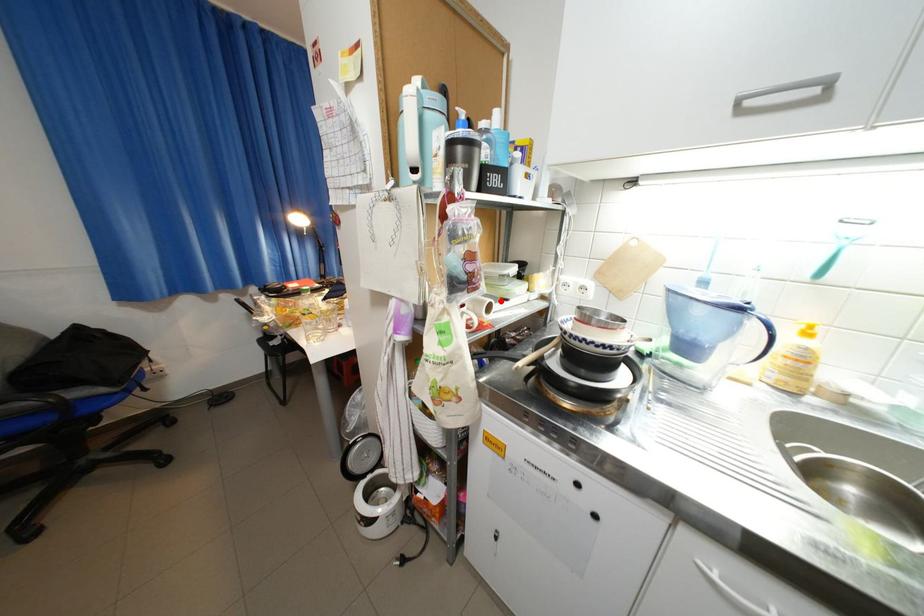
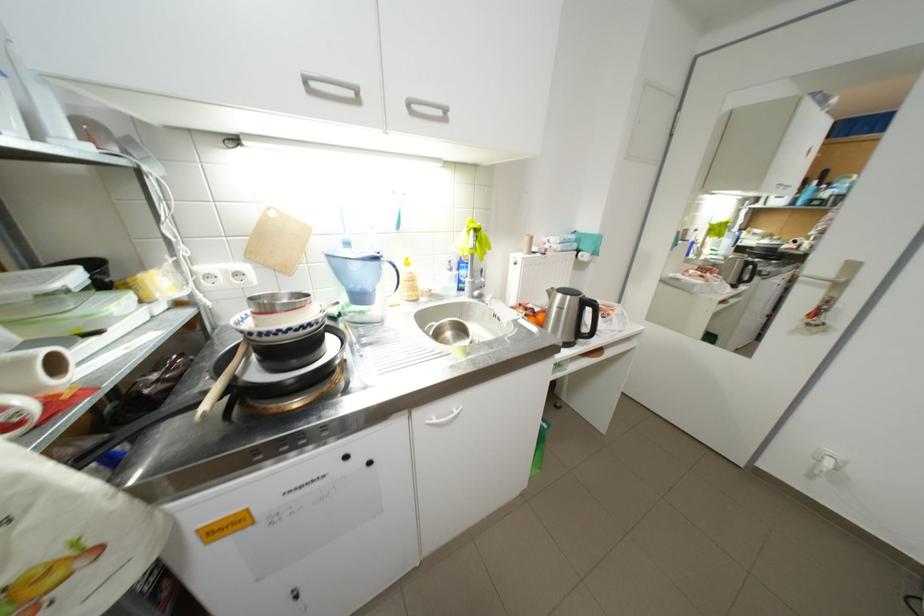
Find the pixel in the second image that matches the highlighted location in the first image.

(54, 352)